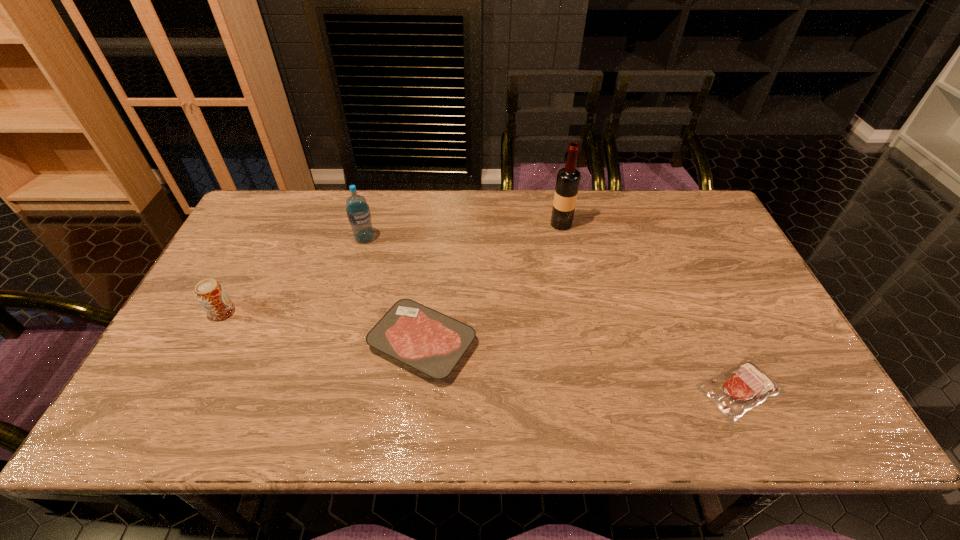
Find the location of a particular element. object at the near right corner is located at coordinates (734, 392).

Locate an element on the screen. Image resolution: width=960 pixels, height=540 pixels. vacant area at the far edge of the desktop is located at coordinates [x=438, y=191].

Where is `free location at the near edge`? The image size is (960, 540). free location at the near edge is located at coordinates (533, 417).

You are a GUI agent. You are given a task and a screenshot of the screen. Output one action in this format:
    pyautogui.click(x=<x>, y=<y>)
    Task: Click on the free spot at the right edge of the desktop
    This screenshot has width=960, height=540.
    Given the screenshot: What is the action you would take?
    pyautogui.click(x=735, y=357)

The width and height of the screenshot is (960, 540). In the image, there is a desktop. Identify the location of blank space at the far left corner. (265, 234).

Locate an element on the screen. This screenshot has height=540, width=960. vacant space at the near left corner of the desktop is located at coordinates (184, 407).

What are the coordinates of `vacant area that lies between the third object from left to right and the fourth nearest object` in the screenshot? It's located at (394, 291).

The height and width of the screenshot is (540, 960). Find the location of `vacant area that lies between the shorter steak and the second object from right to left`. vacant area that lies between the shorter steak and the second object from right to left is located at coordinates (651, 306).

At what (x,y) coordinates should I click in order to perform the action: click on free space between the right steak and the farthest object. Please return your answer as a coordinate pair (x, y). The width and height of the screenshot is (960, 540). Looking at the image, I should click on (651, 306).

The height and width of the screenshot is (540, 960). Identify the location of vacant area between the second tallest object and the taller steak. (394, 291).